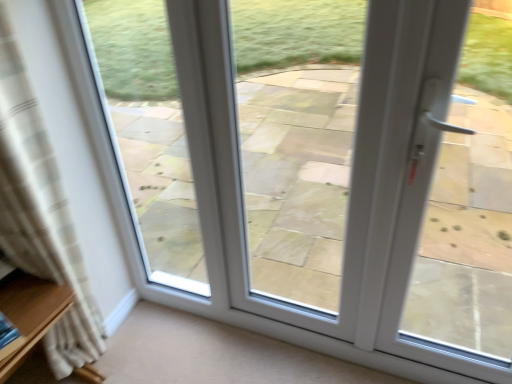
Question: Is white glass door at center to the left of beige plaid curtain at left from the viewer's perspective?

Choices:
 (A) yes
 (B) no

Answer: (B)

Question: From the image's perspective, would you say white glass door at center is positioned over beige plaid curtain at left?

Choices:
 (A) yes
 (B) no

Answer: (A)

Question: Considering the relative sizes of white glass door at center and beige plaid curtain at left in the image provided, is white glass door at center smaller than beige plaid curtain at left?

Choices:
 (A) yes
 (B) no

Answer: (A)

Question: Could you tell me if white glass door at center is turned towards beige plaid curtain at left?

Choices:
 (A) no
 (B) yes

Answer: (A)

Question: Does white glass door at center touch beige plaid curtain at left?

Choices:
 (A) no
 (B) yes

Answer: (A)

Question: In terms of width, does beige plaid curtain at left look wider or thinner when compared to white plastic door handle at right?

Choices:
 (A) wide
 (B) thin

Answer: (A)

Question: Would you say beige plaid curtain at left is to the left or to the right of white plastic door handle at right in the picture?

Choices:
 (A) right
 (B) left

Answer: (B)

Question: From the image's perspective, is beige plaid curtain at left located above or below white plastic door handle at right?

Choices:
 (A) above
 (B) below

Answer: (A)

Question: From a real-world perspective, is beige plaid curtain at left physically located above or below white plastic door handle at right?

Choices:
 (A) above
 (B) below

Answer: (B)

Question: Is point (322, 178) closer or farther from the camera than point (483, 142)?

Choices:
 (A) closer
 (B) farther

Answer: (A)

Question: In the image, is white glass door at center on the left side or the right side of white plastic door handle at right?

Choices:
 (A) left
 (B) right

Answer: (A)

Question: Considering the positions of white glass door at center and white plastic door handle at right in the image, is white glass door at center taller or shorter than white plastic door handle at right?

Choices:
 (A) short
 (B) tall

Answer: (A)

Question: From the image's perspective, is white glass door at center positioned above or below white plastic door handle at right?

Choices:
 (A) above
 (B) below

Answer: (A)

Question: Does point (278, 178) appear closer or farther from the camera than point (5, 291)?

Choices:
 (A) closer
 (B) farther

Answer: (B)

Question: In terms of width, does white glass door at center look wider or thinner when compared to wooden shelf at left?

Choices:
 (A) thin
 (B) wide

Answer: (A)